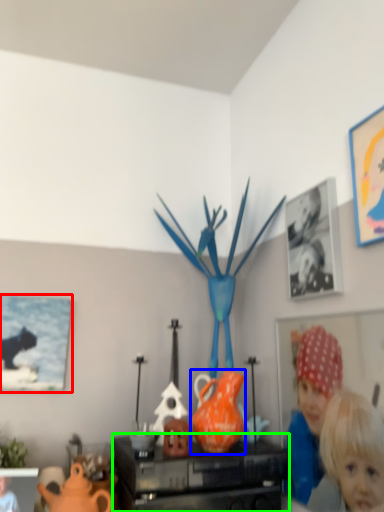
Question: Considering the real-world distances, which object is closest to picture frame (highlighted by a red box)? vase (highlighted by a blue box) or furniture (highlighted by a green box).

Choices:
 (A) vase
 (B) furniture

Answer: (B)